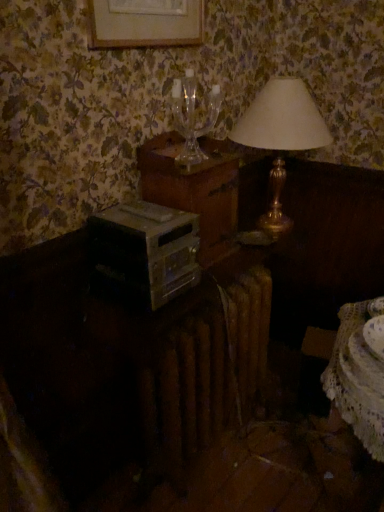
Question: Is white lace table at lower right shorter than transparent glass wine glass at upper center?

Choices:
 (A) yes
 (B) no

Answer: (A)

Question: Is white lace table at lower right completely or partially outside of transparent glass wine glass at upper center?

Choices:
 (A) no
 (B) yes

Answer: (B)

Question: Is white lace table at lower right aimed at transparent glass wine glass at upper center?

Choices:
 (A) no
 (B) yes

Answer: (A)

Question: From a real-world perspective, does white lace table at lower right stand above transparent glass wine glass at upper center?

Choices:
 (A) no
 (B) yes

Answer: (A)

Question: From the image's perspective, does white lace table at lower right appear higher than transparent glass wine glass at upper center?

Choices:
 (A) no
 (B) yes

Answer: (A)

Question: Considering their positions, is white lace table at lower right located in front of or behind wooden nightstand at center?

Choices:
 (A) front
 (B) behind

Answer: (A)

Question: Would you say white lace table at lower right is to the left or to the right of wooden nightstand at center in the picture?

Choices:
 (A) left
 (B) right

Answer: (B)

Question: From a real-world perspective, is white lace table at lower right positioned above or below wooden nightstand at center?

Choices:
 (A) above
 (B) below

Answer: (B)

Question: Would you say white lace table at lower right is inside or outside wooden nightstand at center?

Choices:
 (A) inside
 (B) outside

Answer: (B)

Question: In the image, is white lace table at lower right positioned in front of or behind transparent glass wine glass at upper center?

Choices:
 (A) front
 (B) behind

Answer: (A)

Question: Visually, is white lace table at lower right positioned to the left or to the right of transparent glass wine glass at upper center?

Choices:
 (A) right
 (B) left

Answer: (A)

Question: Considering the positions of white lace table at lower right and transparent glass wine glass at upper center in the image, is white lace table at lower right bigger or smaller than transparent glass wine glass at upper center?

Choices:
 (A) small
 (B) big

Answer: (A)

Question: From the image's perspective, is white lace table at lower right located above or below transparent glass wine glass at upper center?

Choices:
 (A) above
 (B) below

Answer: (B)

Question: Visually, is transparent glass wine glass at upper center positioned to the left or to the right of wooden nightstand at center?

Choices:
 (A) right
 (B) left

Answer: (B)

Question: From the image's perspective, is transparent glass wine glass at upper center positioned above or below wooden nightstand at center?

Choices:
 (A) above
 (B) below

Answer: (A)